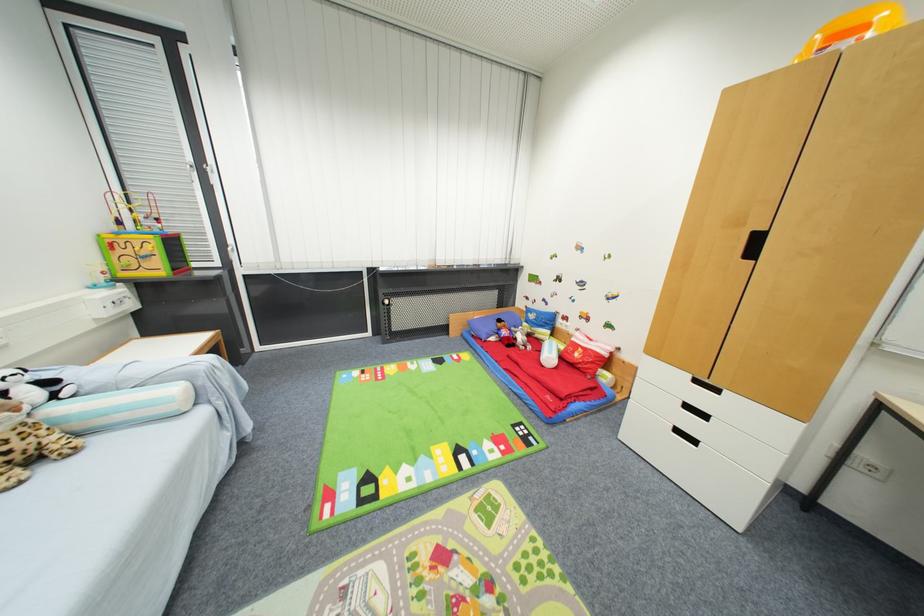
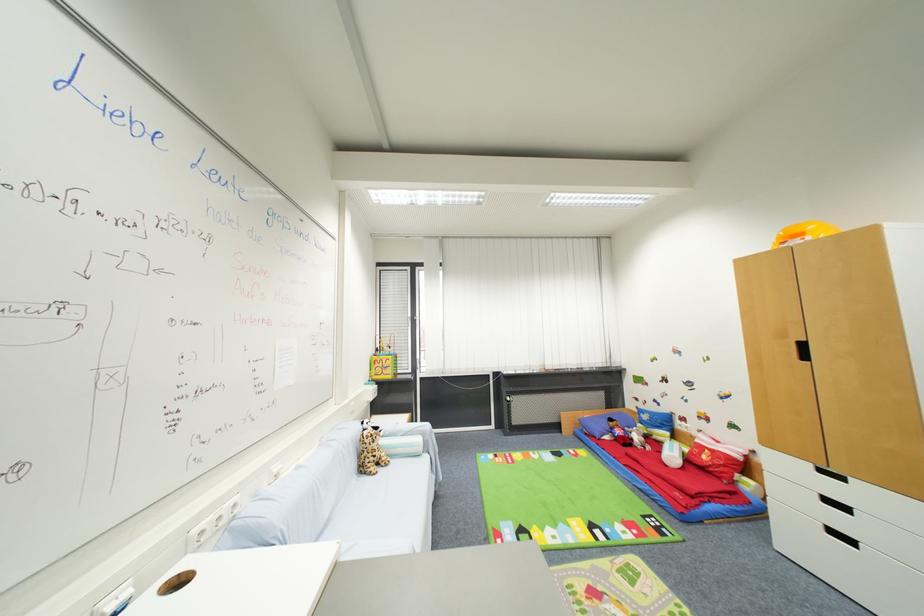
In the second image, find the point that corresponds to (x=698, y=442) in the first image.

(857, 544)